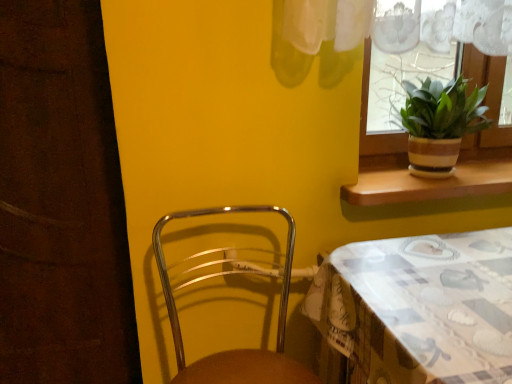
Question: Can you confirm if brown wood at upper right is wider than patterned fabric table at lower right?

Choices:
 (A) yes
 (B) no

Answer: (B)

Question: Is brown wood at upper right looking in the opposite direction of patterned fabric table at lower right?

Choices:
 (A) no
 (B) yes

Answer: (A)

Question: Considering the relative sizes of brown wood at upper right and patterned fabric table at lower right in the image provided, is brown wood at upper right smaller than patterned fabric table at lower right?

Choices:
 (A) no
 (B) yes

Answer: (B)

Question: From the image's perspective, would you say brown wood at upper right is positioned over patterned fabric table at lower right?

Choices:
 (A) no
 (B) yes

Answer: (B)

Question: Can you confirm if brown wood at upper right is shorter than patterned fabric table at lower right?

Choices:
 (A) no
 (B) yes

Answer: (B)

Question: Is patterned fabric table at lower right in front of or behind metallic brown chair at lower left in the image?

Choices:
 (A) front
 (B) behind

Answer: (A)

Question: Looking at the image, does patterned fabric table at lower right seem bigger or smaller compared to metallic brown chair at lower left?

Choices:
 (A) big
 (B) small

Answer: (A)

Question: From a real-world perspective, is patterned fabric table at lower right positioned above or below metallic brown chair at lower left?

Choices:
 (A) above
 (B) below

Answer: (B)

Question: From their relative heights in the image, would you say patterned fabric table at lower right is taller or shorter than metallic brown chair at lower left?

Choices:
 (A) tall
 (B) short

Answer: (A)

Question: Is brown wood at upper right in front of or behind green striped pot at window in the image?

Choices:
 (A) behind
 (B) front

Answer: (A)

Question: Is brown wood at upper right taller or shorter than green striped pot at window?

Choices:
 (A) short
 (B) tall

Answer: (A)

Question: Based on their sizes in the image, would you say brown wood at upper right is bigger or smaller than green striped pot at window?

Choices:
 (A) small
 (B) big

Answer: (A)

Question: Is brown wood at upper right inside or outside of green striped pot at window?

Choices:
 (A) outside
 (B) inside

Answer: (A)

Question: From a real-world perspective, is metallic brown chair at lower left physically located above or below brown wood at upper right?

Choices:
 (A) below
 (B) above

Answer: (A)

Question: Is point (280, 369) closer or farther from the camera than point (387, 180)?

Choices:
 (A) closer
 (B) farther

Answer: (A)